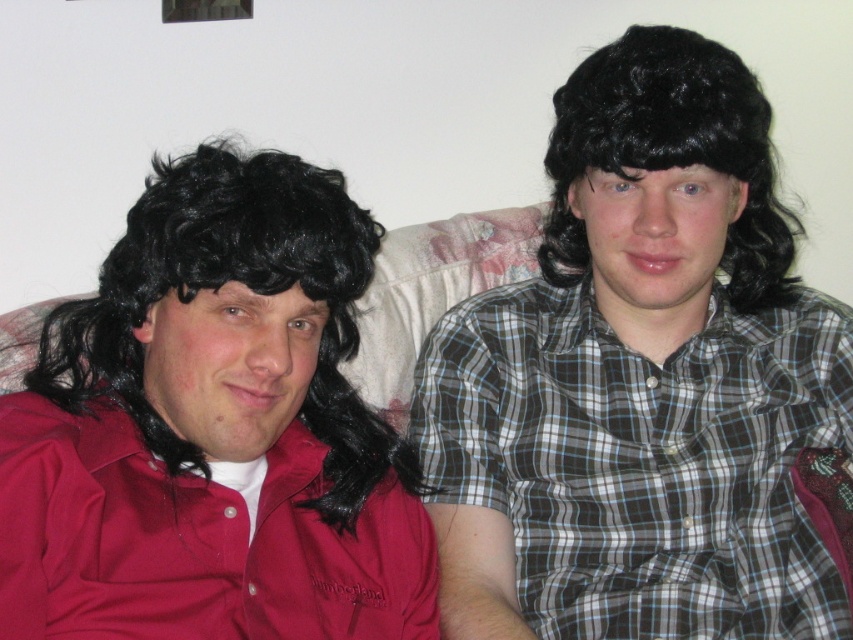
Question: Is matte black wig at left thinner than plaid shirt at right?

Choices:
 (A) yes
 (B) no

Answer: (A)

Question: Which point is farther to the camera?

Choices:
 (A) (612, 540)
 (B) (251, 480)
 (C) (669, 118)

Answer: (A)

Question: Is plaid shirt at right behind black curly wig at upper right?

Choices:
 (A) no
 (B) yes

Answer: (B)

Question: Which point is farther to the camera?

Choices:
 (A) (67, 504)
 (B) (779, 480)

Answer: (B)

Question: Is matte black wig at left below black curly wig at upper right?

Choices:
 (A) no
 (B) yes

Answer: (B)

Question: Estimate the real-world distances between objects in this image. Which object is farther from the matte black wig at left?

Choices:
 (A) plaid shirt at right
 (B) black curly wig at upper right

Answer: (B)